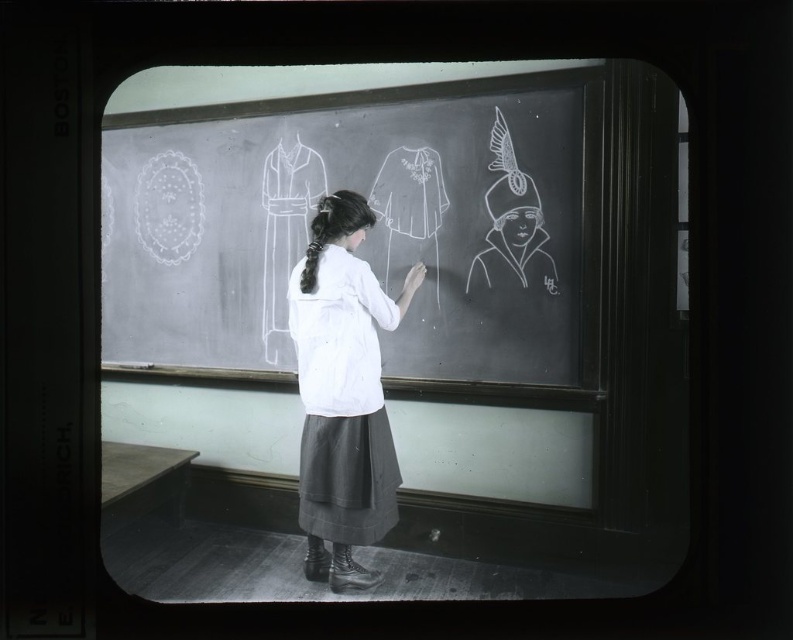
Is white cotton blouse at center positioned before white chalk dress at center?

That is True.

Is white cotton blouse at center further to camera compared to white chalk dress at center?

No, it is in front of white chalk dress at center.

Image resolution: width=793 pixels, height=640 pixels. What are the coordinates of `white cotton blouse at center` in the screenshot? It's located at (343, 392).